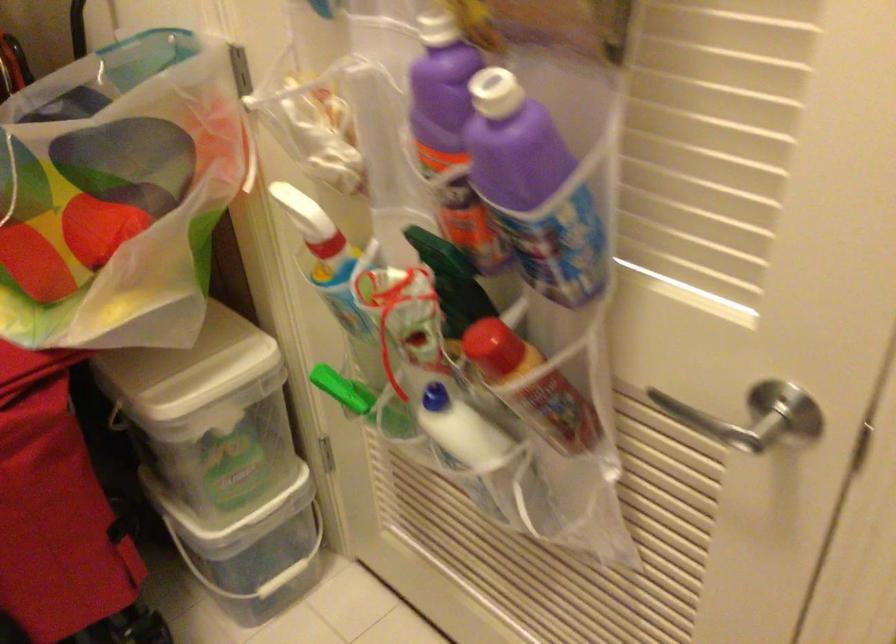
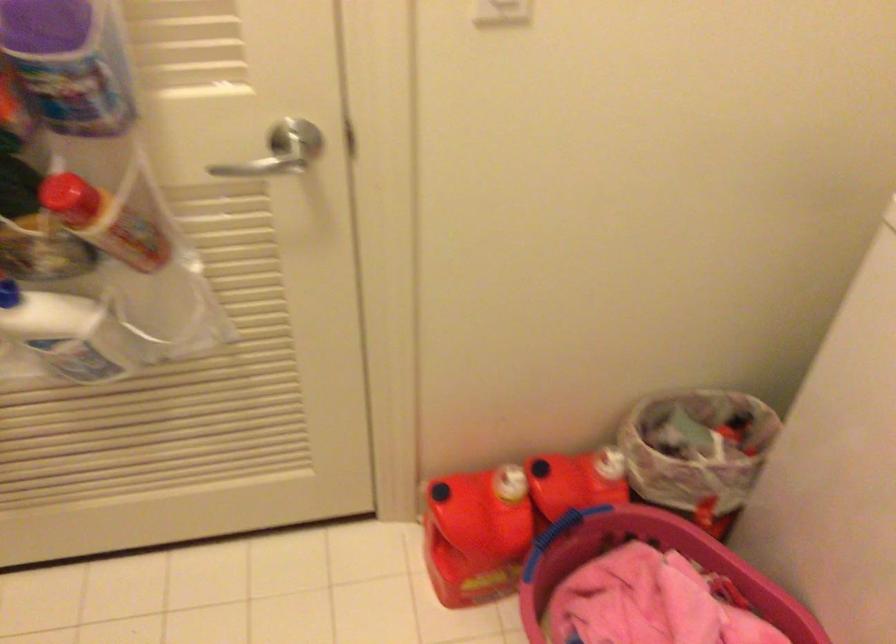
In the second image, find the point that corresponds to [769,406] in the first image.

(283, 137)